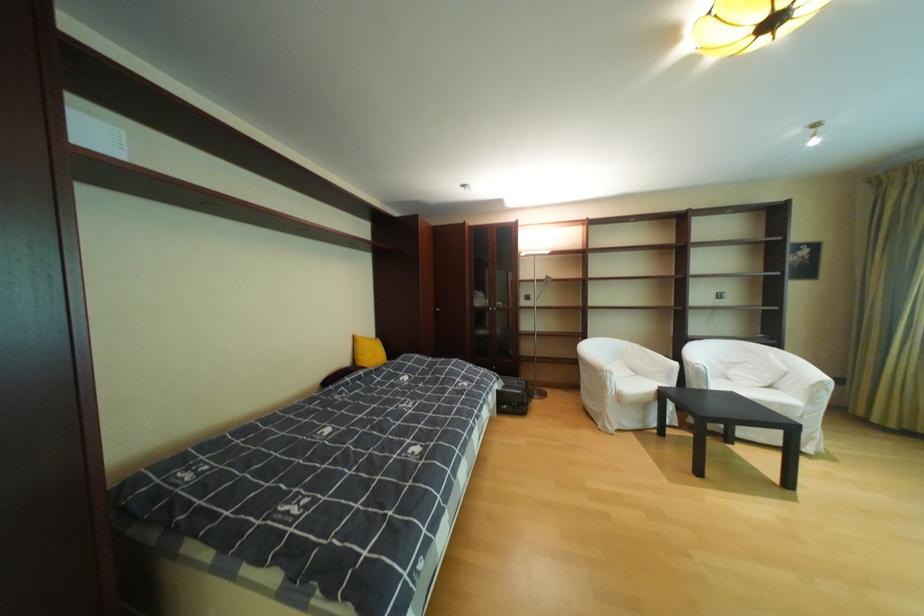
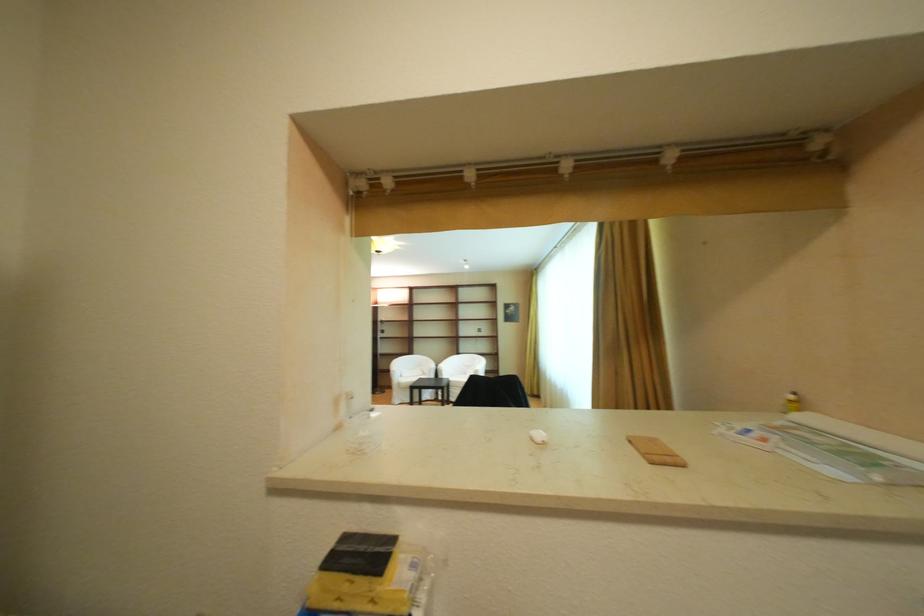
Find the pixel in the second image that matches point 638,345 in the first image.

(436, 359)